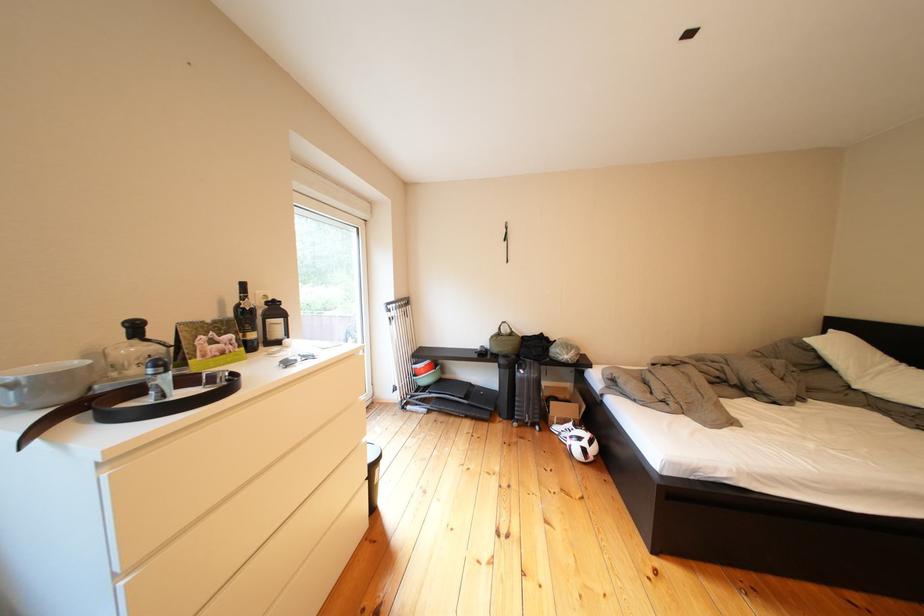
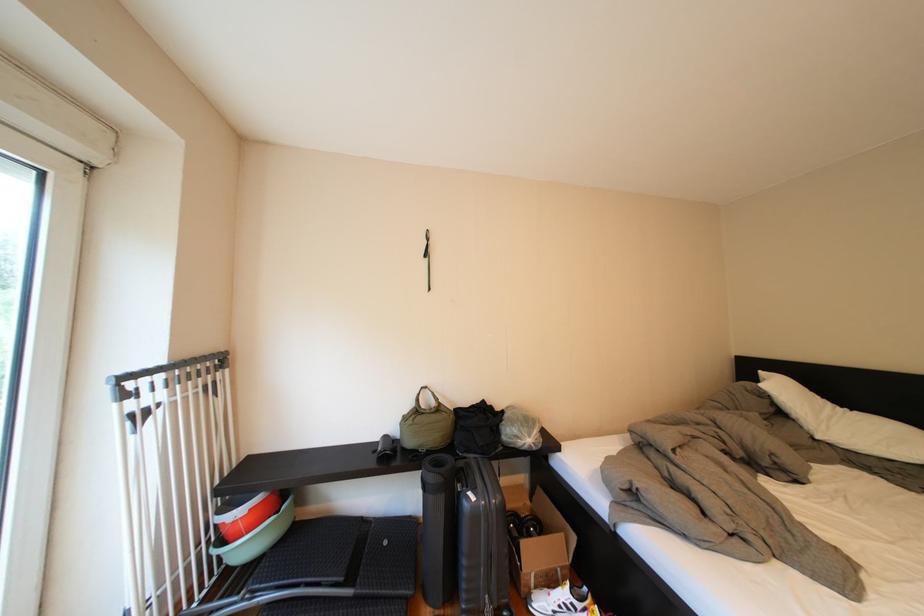
Question: What movement of the cameraman would produce the second image?

Choices:
 (A) Left
 (B) Right
 (C) Forward
 (D) Backward

Answer: (C)